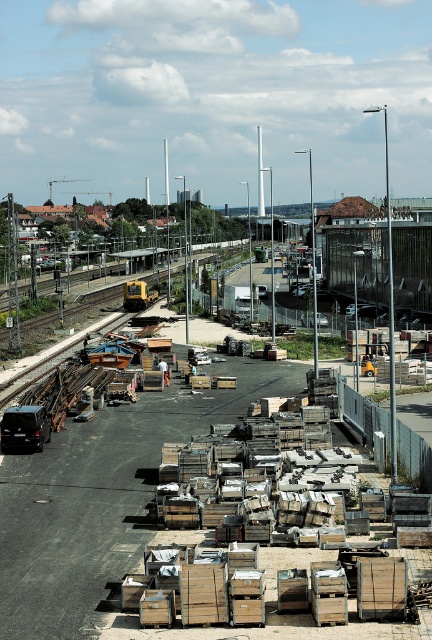
Question: Among these points, which one is farthest from the camera?

Choices:
 (A) (149, 292)
 (B) (145, 474)

Answer: (A)

Question: Can you confirm if wooden crates at center is wider than yellow rubber train at center?

Choices:
 (A) yes
 (B) no

Answer: (A)

Question: Can you confirm if wooden crates at center is positioned above yellow rubber train at center?

Choices:
 (A) no
 (B) yes

Answer: (A)

Question: Among these points, which one is farthest from the camera?

Choices:
 (A) (107, 445)
 (B) (155, 294)

Answer: (B)

Question: Which point is farther to the camera?

Choices:
 (A) (132, 300)
 (B) (63, 528)

Answer: (A)

Question: Does wooden crates at center appear on the right side of yellow rubber train at center?

Choices:
 (A) yes
 (B) no

Answer: (A)